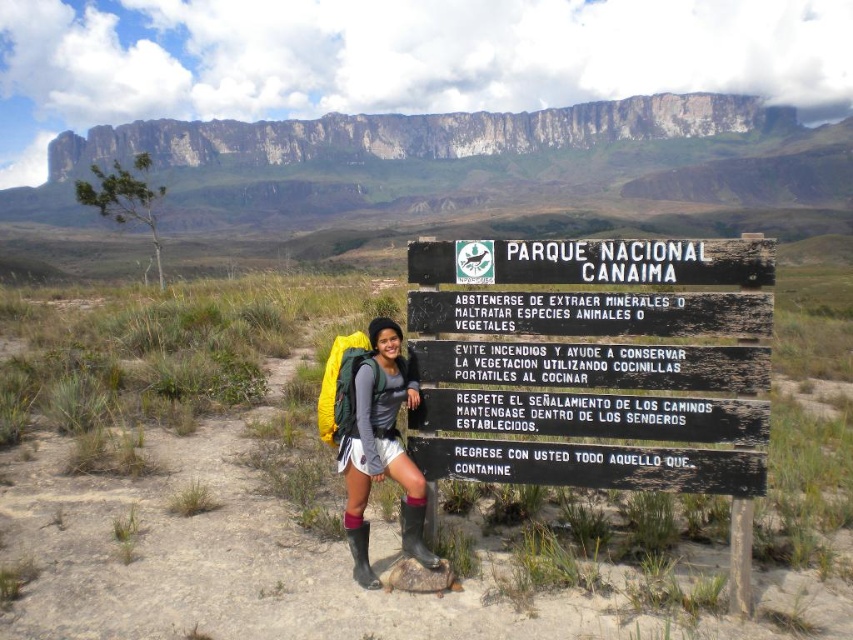
Question: Can you confirm if black wooden sign at center is positioned above matte green backpack at center?

Choices:
 (A) yes
 (B) no

Answer: (A)

Question: Which object is positioned farthest from the white rocky cliff at upper center?

Choices:
 (A) black wooden sign at center
 (B) matte green backpack at center

Answer: (B)

Question: Which point is farther from the camera taking this photo?

Choices:
 (A) (355, 145)
 (B) (488, 301)
 (C) (347, 355)

Answer: (A)

Question: Which of the following is the farthest from the observer?

Choices:
 (A) white rocky cliff at upper center
 (B) matte green backpack at center
 (C) black wooden sign at center

Answer: (A)

Question: Is white rocky cliff at upper center to the right of matte green backpack at center from the viewer's perspective?

Choices:
 (A) no
 (B) yes

Answer: (A)

Question: Can you confirm if black wooden sign at center is positioned to the right of white rocky cliff at upper center?

Choices:
 (A) yes
 (B) no

Answer: (A)